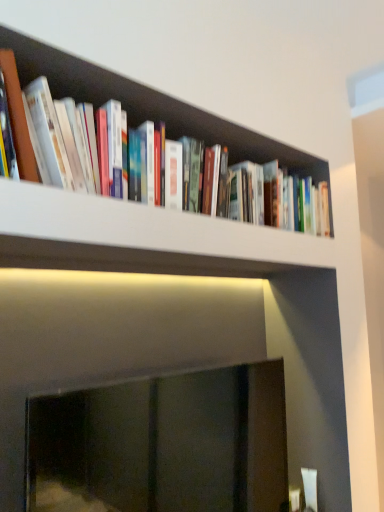
Describe the element at coordinates (153, 106) in the screenshot. Image resolution: width=384 pixels, height=512 pixels. I see `hardcover books at upper center` at that location.

In order to click on hardcover books at upper center in this screenshot , I will do `click(153, 106)`.

Image resolution: width=384 pixels, height=512 pixels. Identify the location of black glass fireplace at center. (162, 444).

This screenshot has height=512, width=384. What do you see at coordinates (162, 444) in the screenshot?
I see `black glass fireplace at center` at bounding box center [162, 444].

Find the location of a particular element. Image resolution: width=384 pixels, height=512 pixels. hardcover books at upper center is located at coordinates (153, 106).

Considering the relative positions of black glass fireplace at center and hardcover books at upper center in the image provided, is black glass fireplace at center to the left or to the right of hardcover books at upper center?

Based on their positions, black glass fireplace at center is located to the left of hardcover books at upper center.

Between black glass fireplace at center and hardcover books at upper center, which one is positioned behind?

hardcover books at upper center is further away from the camera.

Between point (40, 487) and point (332, 219), which one is positioned behind?

The point (332, 219) is behind.

From the image's perspective, is black glass fireplace at center beneath hardcover books at upper center?

Correct, black glass fireplace at center appears lower than hardcover books at upper center in the image.

From a real-world perspective, is black glass fireplace at center over hardcover books at upper center?

No, from a real-world perspective, black glass fireplace at center is not over hardcover books at upper center

Looking at their sizes, would you say black glass fireplace at center is wider or thinner than hardcover books at upper center?

Clearly, black glass fireplace at center has less width compared to hardcover books at upper center.

Considering the relative sizes of black glass fireplace at center and hardcover books at upper center in the image provided, is black glass fireplace at center taller than hardcover books at upper center?

Yes.

Considering the sizes of objects black glass fireplace at center and hardcover books at upper center in the image provided, who is bigger, black glass fireplace at center or hardcover books at upper center?

black glass fireplace at center.

Would you say black glass fireplace at center is inside or outside hardcover books at upper center?

black glass fireplace at center is spatially situated outside hardcover books at upper center.

Are black glass fireplace at center and hardcover books at upper center far apart?

No.

Is black glass fireplace at center facing away from hardcover books at upper center?

black glass fireplace at center does not have its back to hardcover books at upper center.

Find the location of `fireplace that is on the left side of hardcover books at upper center`. fireplace that is on the left side of hardcover books at upper center is located at coordinates (162, 444).

Between hardcover books at upper center and black glass fireplace at center, which one appears on the left side from the viewer's perspective?

black glass fireplace at center is more to the left.

Based on the photo, who is more distant, hardcover books at upper center or black glass fireplace at center?

hardcover books at upper center is further away from the camera.

Is point (258, 140) in front of point (174, 488)?

No, it is behind (174, 488).

From the image's perspective, does hardcover books at upper center appear lower than black glass fireplace at center?

Actually, hardcover books at upper center appears above black glass fireplace at center in the image.

From a real-world perspective, is hardcover books at upper center on black glass fireplace at center?

Correct, in the physical world, hardcover books at upper center is higher than black glass fireplace at center.

Considering the sizes of objects hardcover books at upper center and black glass fireplace at center in the image provided, who is wider, hardcover books at upper center or black glass fireplace at center?

Wider between the two is hardcover books at upper center.

Considering the relative sizes of hardcover books at upper center and black glass fireplace at center in the image provided, is hardcover books at upper center shorter than black glass fireplace at center?

Indeed, hardcover books at upper center has a lesser height compared to black glass fireplace at center.

Who is bigger, hardcover books at upper center or black glass fireplace at center?

black glass fireplace at center.

Is hardcover books at upper center surrounding black glass fireplace at center?

No, black glass fireplace at center is not inside hardcover books at upper center.

Is hardcover books at upper center with black glass fireplace at center?

hardcover books at upper center is not next to black glass fireplace at center, and they're not touching.

Is black glass fireplace at center at the back of hardcover books at upper center?

hardcover books at upper center does not have its back to black glass fireplace at center.

How many degrees apart are the facing directions of hardcover books at upper center and black glass fireplace at center?

There is a 0.000697-degree angle between the facing directions of hardcover books at upper center and black glass fireplace at center.

At what (x,y) coordinates should I click in order to perform the action: click on fireplace on the left side of hardcover books at upper center. Please return your answer as a coordinate pair (x, y). This screenshot has width=384, height=512. Looking at the image, I should click on (162, 444).

You are a GUI agent. You are given a task and a screenshot of the screen. Output one action in this format:
    pyautogui.click(x=<x>, y=<y>)
    Task: Click on the fireplace below the hardcover books at upper center (from a real-world perspective)
    The image size is (384, 512).
    Given the screenshot: What is the action you would take?
    pyautogui.click(x=162, y=444)

I want to click on book behind the black glass fireplace at center, so click(153, 106).